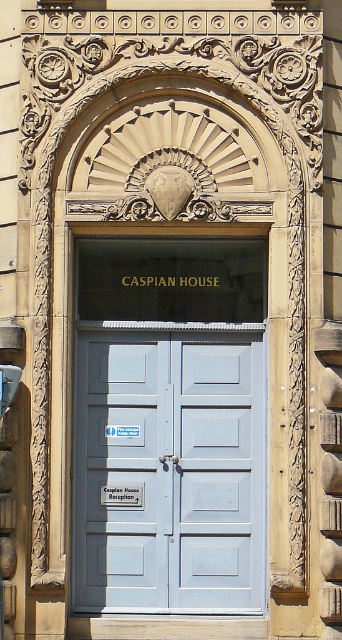
Which is more to the left, light blue wood door at center or white plastic street sign at center?

From the viewer's perspective, white plastic street sign at center appears more on the left side.

Is light blue wood door at center below white plastic street sign at center?

Yes.

Where is `light blue wood door at center`? light blue wood door at center is located at coordinates (168, 470).